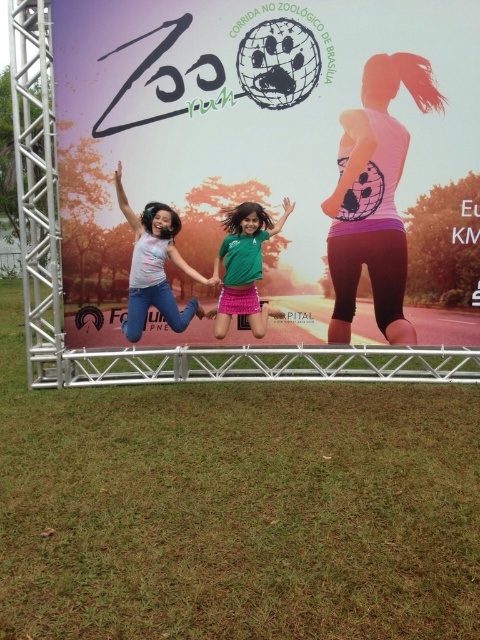
Does matte white banner at center appear under pink matte tank top at upper right?

No.

Is point (314, 243) behind point (368, 179)?

Yes, it is behind point (368, 179).

Where is `matte white banner at center`? matte white banner at center is located at coordinates (272, 144).

Which is behind, point (67, 42) or point (255, 269)?

Positioned behind is point (67, 42).

Can you confirm if matte white banner at center is wider than green matte skirt at center?

Correct, the width of matte white banner at center exceeds that of green matte skirt at center.

Is point (290, 275) positioned after point (239, 294)?

Yes, point (290, 275) is farther from viewer.

At what (x,y) coordinates should I click in order to perform the action: click on matte white banner at center. Please return your answer as a coordinate pair (x, y). The width and height of the screenshot is (480, 640). Looking at the image, I should click on (272, 144).

Who is higher up, pink matte tank top at upper right or green matte skirt at center?

Positioned higher is pink matte tank top at upper right.

Which of these two, pink matte tank top at upper right or green matte skirt at center, stands shorter?

green matte skirt at center is shorter.

Which is behind, point (338, 243) or point (264, 330)?

The point (338, 243) is more distant.

Locate an element on the screen. pink matte tank top at upper right is located at coordinates point(373,196).